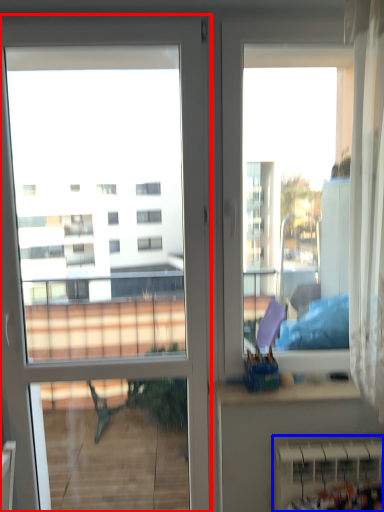
Question: Which point is closer to the camera, door (highlighted by a red box) or radiator (highlighted by a blue box)?

Choices:
 (A) door
 (B) radiator

Answer: (A)